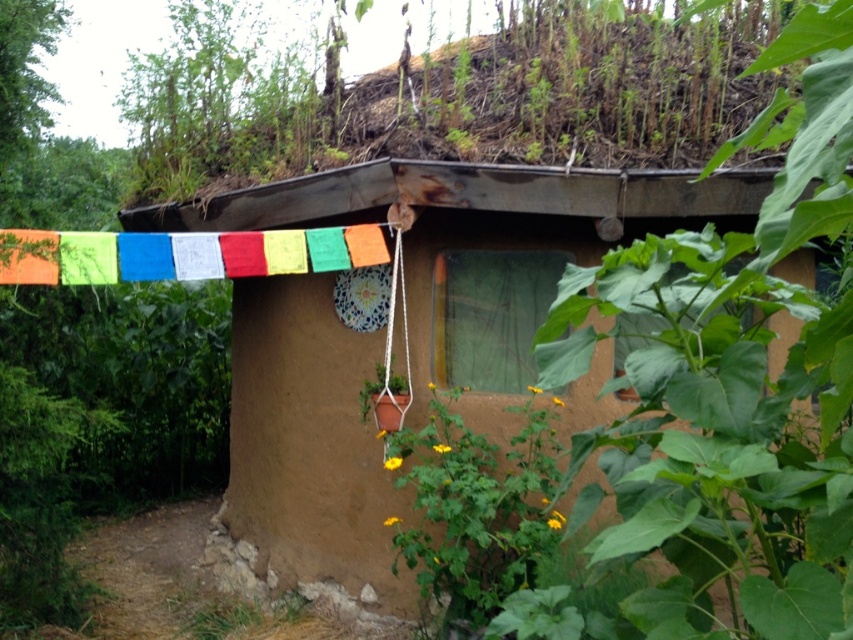
Which is above, brown clay hut at center or yellow-green leafy plant at lower center?

brown clay hut at center is above.

Between point (579, 464) and point (537, 557), which one is positioned in front?

Positioned in front is point (579, 464).

What are the coordinates of `brown clay hut at center` in the screenshot? It's located at (639, 374).